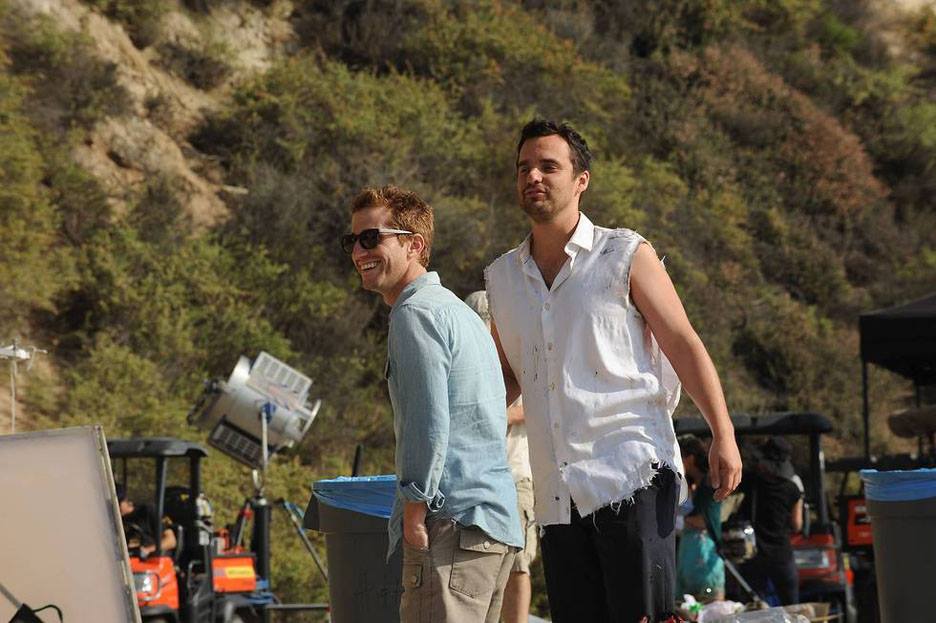
You are a GUI agent. You are given a task and a screenshot of the screen. Output one action in this format:
    pyautogui.click(x=<x>, y=<y>)
    Task: Click on the trash cans
    
    Given the screenshot: What is the action you would take?
    pyautogui.click(x=366, y=531), pyautogui.click(x=904, y=554)